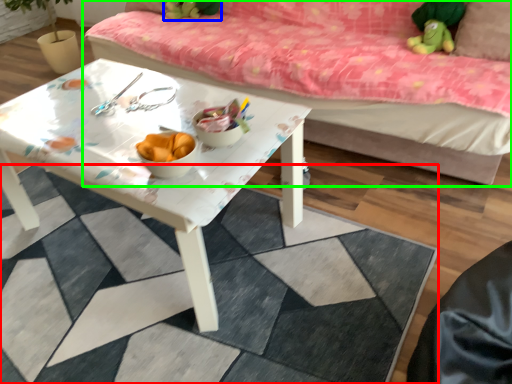
Question: Considering the real-world distances, which object is farthest from tile (highlighted by a red box)? toy (highlighted by a blue box) or studio couch (highlighted by a green box)?

Choices:
 (A) toy
 (B) studio couch

Answer: (A)